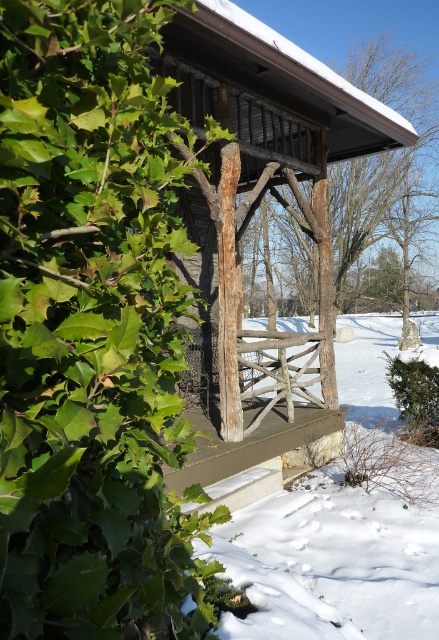
I want to click on smooth brown tree trunk at center, so click(92, 330).

Does smooth brown tree trunk at center appear under white wooden fence at lower center?

Actually, smooth brown tree trunk at center is above white wooden fence at lower center.

You are a GUI agent. You are given a task and a screenshot of the screen. Output one action in this format:
    pyautogui.click(x=<x>, y=<y>)
    Task: Click on the smooth brown tree trunk at center
    
    Given the screenshot: What is the action you would take?
    pyautogui.click(x=92, y=330)

Can you confirm if white wooden fence at lower center is wider than rustic wooden fence post at center?

No.

Based on the photo, does white wooden fence at lower center have a lesser width compared to rustic wooden fence post at center?

Correct, white wooden fence at lower center's width is less than rustic wooden fence post at center's.

At what (x,y) coordinates should I click in order to perform the action: click on white wooden fence at lower center. Please return your answer as a coordinate pair (x, y). This screenshot has width=439, height=640. Looking at the image, I should click on (335, 557).

Is smooth brown tree trunk at center positioned before rustic wooden porch at center?

Yes, it is.

Who is positioned more to the left, smooth brown tree trunk at center or rustic wooden porch at center?

Positioned to the left is smooth brown tree trunk at center.

Is point (61, 141) farther from viewer compared to point (274, 401)?

That is False.

This screenshot has width=439, height=640. I want to click on smooth brown tree trunk at center, so click(x=92, y=330).